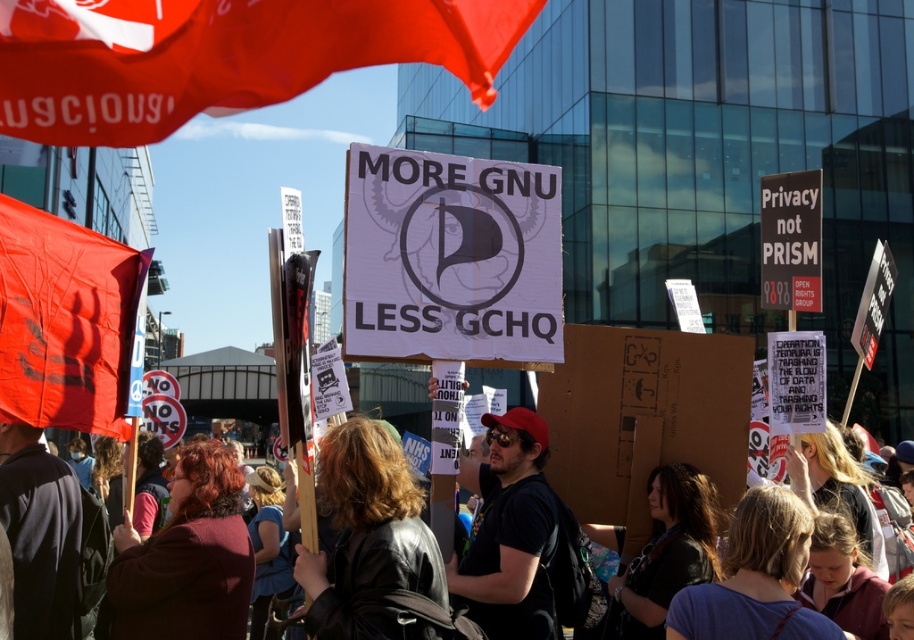
Question: Is dark brown leather jacket at lower left wider than matte black shirt at center?

Choices:
 (A) yes
 (B) no

Answer: (B)

Question: Can you confirm if matte black shirt at center is positioned to the right of black leather jacket at center?

Choices:
 (A) no
 (B) yes

Answer: (B)

Question: Which object appears closest to the camera in this image?

Choices:
 (A) matte red flag at upper left
 (B) matte black shirt at center
 (C) matte red flag at left

Answer: (A)

Question: Is dark brown leather jacket at lower left below black leather jacket at center?

Choices:
 (A) yes
 (B) no

Answer: (A)

Question: Which of the following is the closest to the observer?

Choices:
 (A) leather jacket at center
 (B) dark brown leather jacket at lower left

Answer: (A)

Question: Which point appears farthest from the camera in this image?

Choices:
 (A) (x=133, y=307)
 (B) (x=98, y=145)
 (C) (x=500, y=582)
 (D) (x=320, y=572)

Answer: (A)